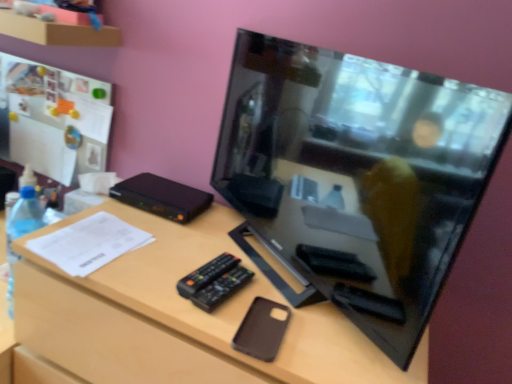
Find the location of a particular element. This screenshot has height=384, width=512. vacant space behind brown matte phone case at center is located at coordinates (261, 277).